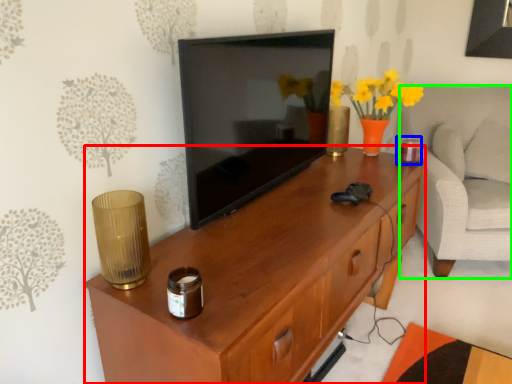
Question: Which object is positioned farthest from desk (highlighted by a red box)? Select from candle holder (highlighted by a blue box) and armchair (highlighted by a green box).

Choices:
 (A) candle holder
 (B) armchair

Answer: (B)